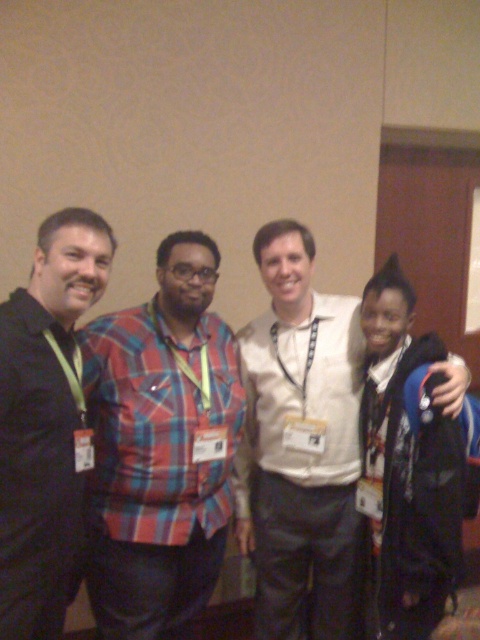
The height and width of the screenshot is (640, 480). Describe the element at coordinates (160, 449) in the screenshot. I see `plaid fabric shirt at center` at that location.

From the picture: Does plaid fabric shirt at center have a lesser width compared to white matte shirt at center?

Correct, plaid fabric shirt at center's width is less than white matte shirt at center's.

Is point (165, 340) behind point (280, 541)?

No, (165, 340) is closer to viewer.

Locate an element on the screen. plaid fabric shirt at center is located at coordinates (160, 449).

Between dark blue jacket at left and black fuzzy hat at right, which one appears on the right side from the viewer's perspective?

Positioned to the right is black fuzzy hat at right.

Does dark blue jacket at left have a greater width compared to black fuzzy hat at right?

In fact, dark blue jacket at left might be narrower than black fuzzy hat at right.

I want to click on dark blue jacket at left, so tap(45, 422).

Who is higher up, white matte shirt at center or black fuzzy hat at right?

black fuzzy hat at right

Can you confirm if white matte shirt at center is thinner than black fuzzy hat at right?

No, white matte shirt at center is not thinner than black fuzzy hat at right.

Image resolution: width=480 pixels, height=640 pixels. I want to click on white matte shirt at center, so click(307, 394).